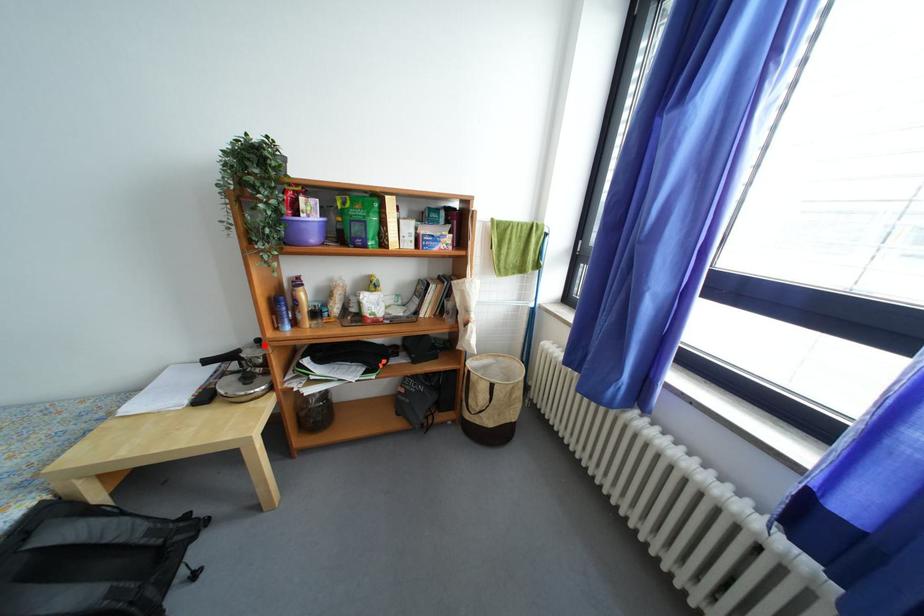
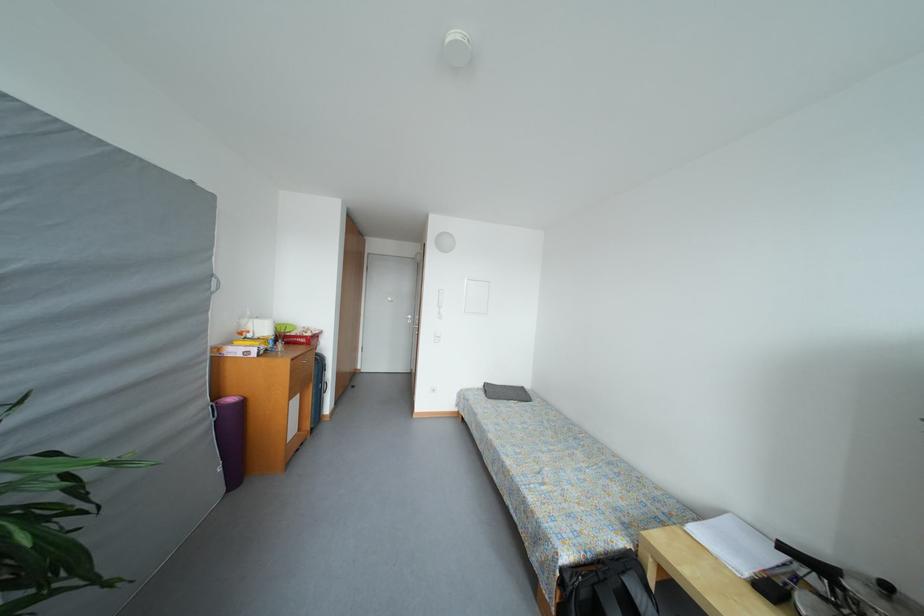
The point at the highlighted location is marked in the first image. Where is the corresponding point in the second image?

(893, 591)